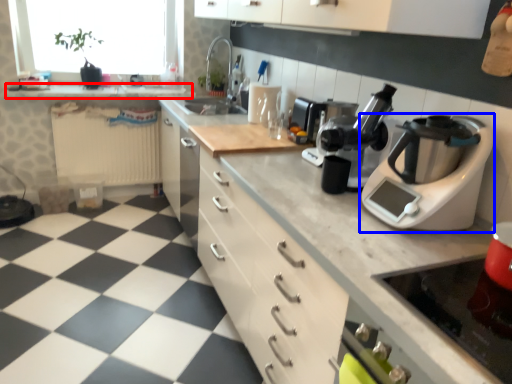
Question: Which object appears closest to the camera in this image, counter top (highlighted by a red box) or home appliance (highlighted by a blue box)?

Choices:
 (A) counter top
 (B) home appliance

Answer: (B)